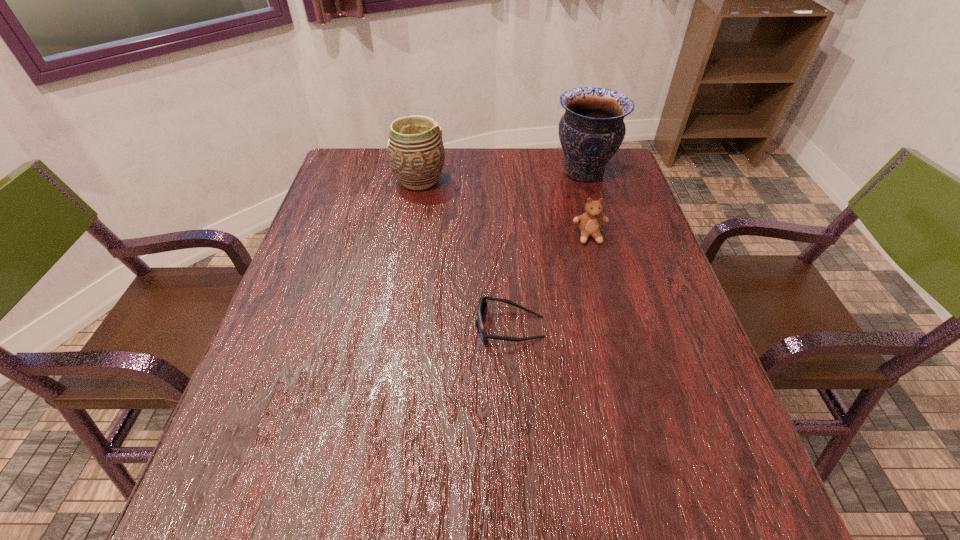
This screenshot has height=540, width=960. Find the location of `free space between the sunglasses and the shorter pottery`. free space between the sunglasses and the shorter pottery is located at coordinates (465, 254).

What are the coordinates of `vacant area that lies between the leftmost object and the teddy bear` in the screenshot? It's located at (504, 208).

Locate an element on the screen. This screenshot has width=960, height=540. vacant area that lies between the nearest object and the second tallest object is located at coordinates (465, 254).

What are the coordinates of `vacant space that's between the taller pottery and the shortest object` in the screenshot? It's located at (547, 249).

Point out which object is positioned as the second nearest to the teddy bear. Please provide its 2D coordinates. Your answer should be formatted as a tuple, i.e. [(x, y)], where the tuple contains the x and y coordinates of a point satisfying the conditions above.

[(482, 304)]

Where is `object that is the closest to the third object from right to left`? object that is the closest to the third object from right to left is located at coordinates (590, 222).

Where is `free space that satisfies the following two spatial constraints: 1. on the front handle of the right pottery; 2. on the front-facing side of the second shortest object`? The width and height of the screenshot is (960, 540). free space that satisfies the following two spatial constraints: 1. on the front handle of the right pottery; 2. on the front-facing side of the second shortest object is located at coordinates (603, 237).

Identify the location of free spot that satisfies the following two spatial constraints: 1. on the front handle of the right pottery; 2. on the front-facing side of the second nearest object. The width and height of the screenshot is (960, 540). (603, 237).